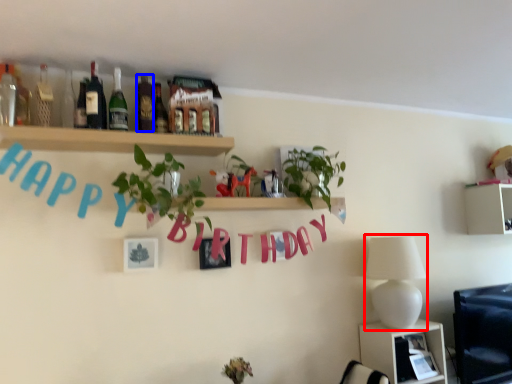
Question: Which of the following is the farthest to the observer, lamp (highlighted by a red box) or bottle (highlighted by a blue box)?

Choices:
 (A) lamp
 (B) bottle

Answer: (A)